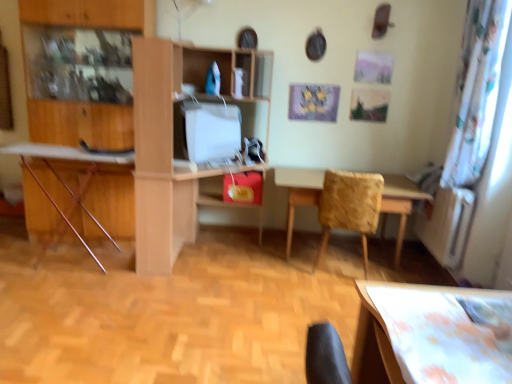
Question: Can you confirm if wooden textured table at center is wider than wooden ironing board at left?

Choices:
 (A) yes
 (B) no

Answer: (A)

Question: Is wooden textured table at center to the right of wooden ironing board at left from the viewer's perspective?

Choices:
 (A) no
 (B) yes

Answer: (B)

Question: Is wooden textured table at center closer to camera compared to wooden ironing board at left?

Choices:
 (A) no
 (B) yes

Answer: (A)

Question: Is wooden textured table at center thinner than wooden ironing board at left?

Choices:
 (A) no
 (B) yes

Answer: (A)

Question: Is wooden textured table at center with wooden ironing board at left?

Choices:
 (A) yes
 (B) no

Answer: (B)

Question: Is wooden ironing board at left at the back of wooden textured table at center?

Choices:
 (A) no
 (B) yes

Answer: (A)

Question: Is wooden textured table at center positioned in front of white glossy computer monitor at center?

Choices:
 (A) yes
 (B) no

Answer: (B)

Question: Is wooden textured table at center outside of white glossy computer monitor at center?

Choices:
 (A) no
 (B) yes

Answer: (B)

Question: Is white glossy computer monitor at center a part of wooden textured table at center?

Choices:
 (A) no
 (B) yes

Answer: (A)

Question: Considering the relative sizes of wooden textured table at center and white glossy computer monitor at center in the image provided, is wooden textured table at center shorter than white glossy computer monitor at center?

Choices:
 (A) yes
 (B) no

Answer: (B)

Question: Does wooden textured table at center have a lesser width compared to white glossy computer monitor at center?

Choices:
 (A) yes
 (B) no

Answer: (B)

Question: Could you tell me if wooden textured table at center is facing white glossy computer monitor at center?

Choices:
 (A) yes
 (B) no

Answer: (B)

Question: Is wooden ironing board at left to the left of light wood/wooden desk at center from the viewer's perspective?

Choices:
 (A) no
 (B) yes

Answer: (B)